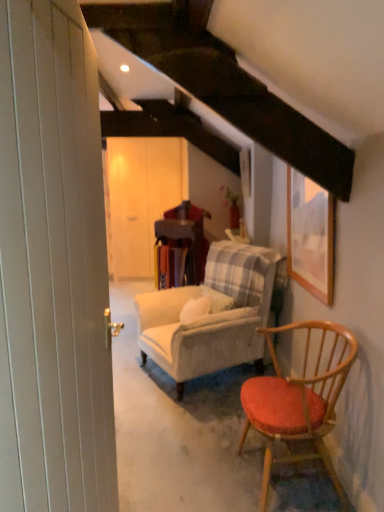
Question: Is wooden table at center at the left side of wooden framed picture at upper right?

Choices:
 (A) yes
 (B) no

Answer: (A)

Question: Can you confirm if wooden table at center is taller than wooden framed picture at upper right?

Choices:
 (A) no
 (B) yes

Answer: (B)

Question: Is wooden table at center beside wooden framed picture at upper right?

Choices:
 (A) no
 (B) yes

Answer: (A)

Question: From the image's perspective, would you say wooden table at center is positioned over wooden framed picture at upper right?

Choices:
 (A) yes
 (B) no

Answer: (B)

Question: Would you say wooden table at center contains wooden framed picture at upper right?

Choices:
 (A) yes
 (B) no

Answer: (B)

Question: Considering the positions of velvet beige armchair at center and wooden framed picture at upper right in the image, is velvet beige armchair at center bigger or smaller than wooden framed picture at upper right?

Choices:
 (A) small
 (B) big

Answer: (B)

Question: Based on their positions, is velvet beige armchair at center located to the left or right of wooden framed picture at upper right?

Choices:
 (A) left
 (B) right

Answer: (A)

Question: Would you say velvet beige armchair at center is inside or outside wooden framed picture at upper right?

Choices:
 (A) inside
 (B) outside

Answer: (B)

Question: Is velvet beige armchair at center wider or thinner than wooden framed picture at upper right?

Choices:
 (A) wide
 (B) thin

Answer: (A)

Question: Does point (155, 230) appear closer or farther from the camera than point (286, 189)?

Choices:
 (A) farther
 (B) closer

Answer: (A)

Question: Is wooden table at center bigger or smaller than wooden framed picture at upper right?

Choices:
 (A) small
 (B) big

Answer: (B)

Question: From their relative heights in the image, would you say wooden table at center is taller or shorter than wooden framed picture at upper right?

Choices:
 (A) tall
 (B) short

Answer: (A)

Question: Is wooden table at center to the left or to the right of wooden framed picture at upper right in the image?

Choices:
 (A) right
 (B) left

Answer: (B)

Question: Considering the positions of velvet beige armchair at center and white wooden barn door at left, the 2th barn door positioned from the back, in the image, is velvet beige armchair at center wider or thinner than white wooden barn door at left, the 2th barn door positioned from the back,?

Choices:
 (A) wide
 (B) thin

Answer: (A)

Question: Is point (238, 282) closer or farther from the camera than point (46, 373)?

Choices:
 (A) closer
 (B) farther

Answer: (B)